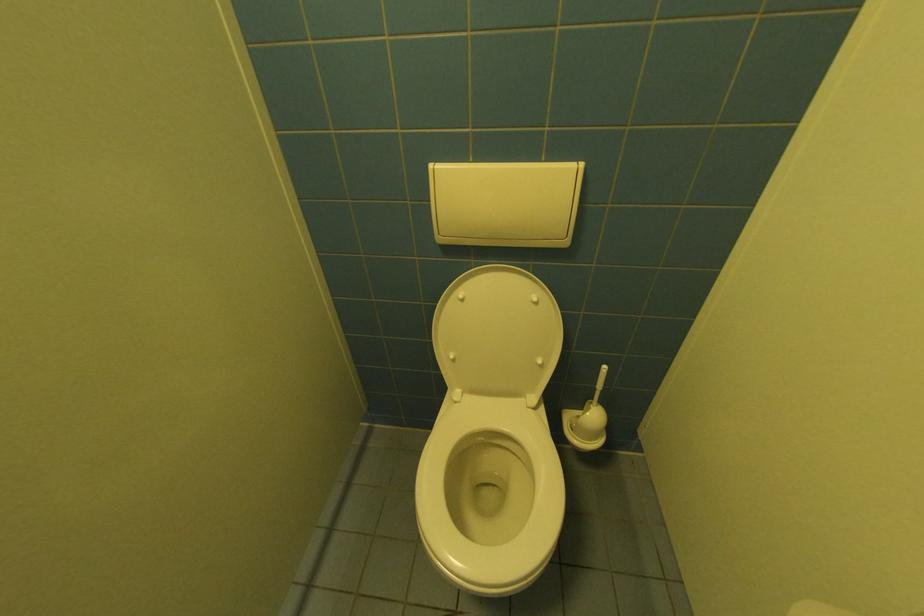
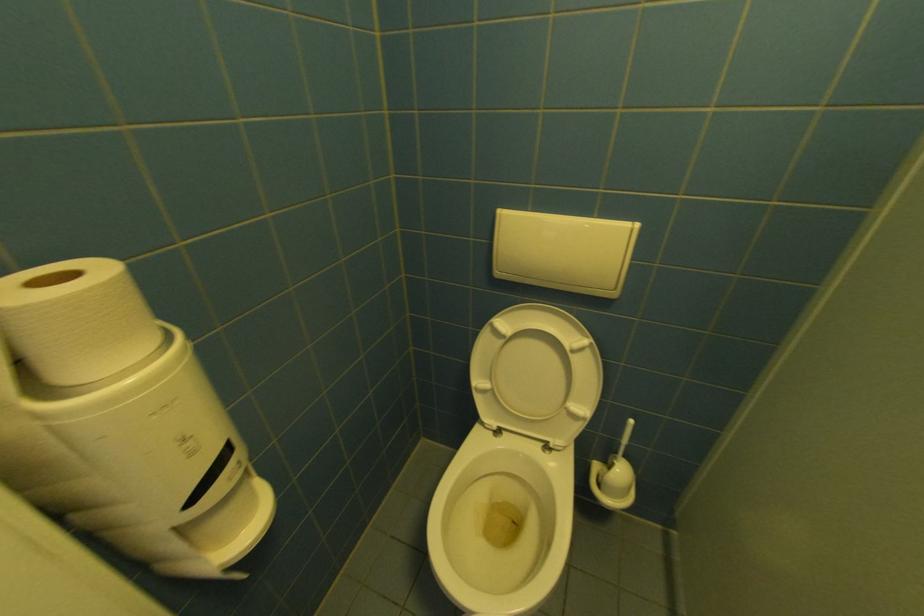
Question: What movement of the cameraman would produce the second image?

Choices:
 (A) Left
 (B) Right
 (C) Forward
 (D) Backward

Answer: (A)